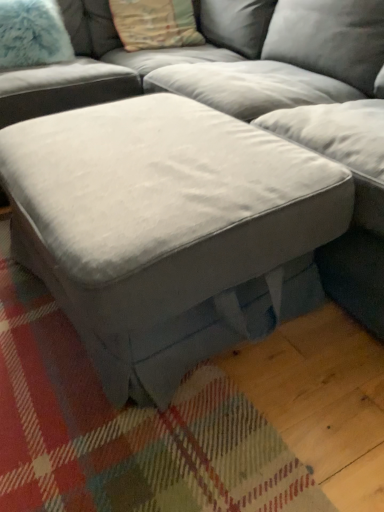
Question: Is fuzzy white pillow at upper left, which is the 1th pillow in left-to-right order, far from textured beige pillow at upper center, arranged as the 1th pillow when viewed from the right?

Choices:
 (A) yes
 (B) no

Answer: (B)

Question: Can you confirm if fuzzy white pillow at upper left, which is the 1th pillow in left-to-right order, is positioned to the right of textured beige pillow at upper center, arranged as the 1th pillow when viewed from the right?

Choices:
 (A) no
 (B) yes

Answer: (A)

Question: Is textured beige pillow at upper center, arranged as the 1th pillow when viewed from the right, located within fuzzy white pillow at upper left, which is the 1th pillow in left-to-right order?

Choices:
 (A) no
 (B) yes

Answer: (A)

Question: From a real-world perspective, is fuzzy white pillow at upper left, the 2th pillow viewed from the right, on textured beige pillow at upper center, the second pillow positioned from the left?

Choices:
 (A) yes
 (B) no

Answer: (A)

Question: Does fuzzy white pillow at upper left, the 2th pillow viewed from the right, appear on the left side of textured beige pillow at upper center, the second pillow positioned from the left?

Choices:
 (A) yes
 (B) no

Answer: (A)

Question: Is fuzzy white pillow at upper left, which is the 1th pillow in left-to-right order, positioned with its back to textured beige pillow at upper center, the second pillow positioned from the left?

Choices:
 (A) no
 (B) yes

Answer: (A)

Question: Is suede gray ottoman at center not inside fuzzy white pillow at upper left, the 2th pillow viewed from the right?

Choices:
 (A) yes
 (B) no

Answer: (A)

Question: Is the position of suede gray ottoman at center more distant than that of fuzzy white pillow at upper left, which is the 1th pillow in left-to-right order?

Choices:
 (A) no
 (B) yes

Answer: (A)

Question: Considering the relative sizes of suede gray ottoman at center and fuzzy white pillow at upper left, the 2th pillow viewed from the right, in the image provided, is suede gray ottoman at center bigger than fuzzy white pillow at upper left, the 2th pillow viewed from the right,?

Choices:
 (A) no
 (B) yes

Answer: (B)

Question: Is suede gray ottoman at center turned away from fuzzy white pillow at upper left, the 2th pillow viewed from the right?

Choices:
 (A) no
 (B) yes

Answer: (A)

Question: Considering the relative sizes of suede gray ottoman at center and fuzzy white pillow at upper left, which is the 1th pillow in left-to-right order, in the image provided, is suede gray ottoman at center shorter than fuzzy white pillow at upper left, which is the 1th pillow in left-to-right order,?

Choices:
 (A) no
 (B) yes

Answer: (A)

Question: Is suede gray ottoman at center closer to the viewer compared to fuzzy white pillow at upper left, the 2th pillow viewed from the right?

Choices:
 (A) yes
 (B) no

Answer: (A)

Question: Is textured beige pillow at upper center, arranged as the 1th pillow when viewed from the right, turned away from suede gray ottoman at center?

Choices:
 (A) no
 (B) yes

Answer: (A)